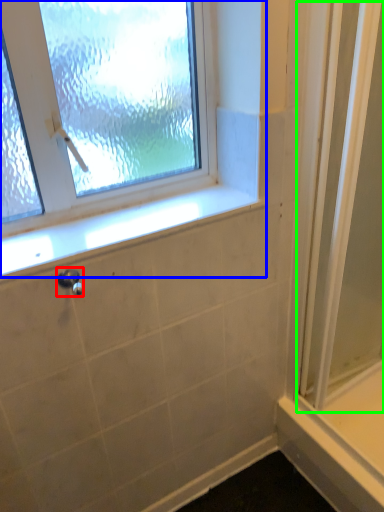
Question: Based on their relative distances, which object is nearer to shower (highlighted by a red box)? Choose from window (highlighted by a blue box) and screen door (highlighted by a green box).

Choices:
 (A) window
 (B) screen door

Answer: (A)